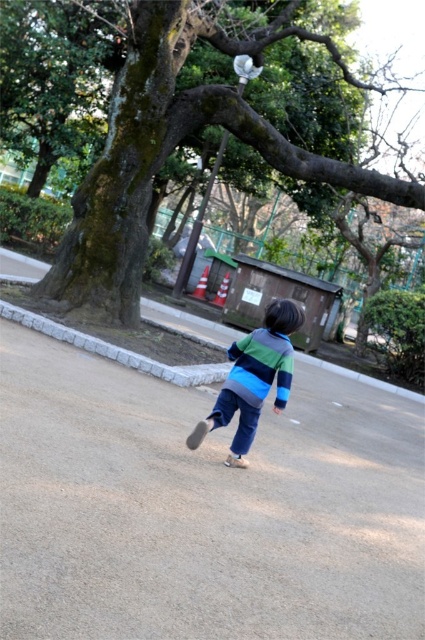
You are a photographer trying to capture a photo of the striped sweater at center while also including the green mossy tree at upper left in the frame. Based on their distance, can you estimate whether they will both fit in the camera frame?

The green mossy tree at upper left and striped sweater at center are 4.71 meters apart. Whether they fit in the frame depends on the camera lens and distance from the subjects. Without specific lens details, it is hard to say for sure, but 4.71 meters is a considerable distance, so they might not both fit unless using a wide angle.

You are a photographer trying to capture the striped sweater at center and the green mossy tree at upper left in the same frame. Based on their positions, which object should you adjust your camera to focus on first to ensure both are in the frame?

You should focus on the green mossy tree at upper left first because it is positioned to the left of the striped sweater at center, so adjusting the frame to include the leftmost object ensures the right side remains within the shot.

You are standing at a point and want to reach the child running away in the park. The path you need to take goes through point (x=391, y=179). If your walking speed is 1.2 meters per second, how long will it take you to reach the child?

The distance between the viewer and point (x=391, y=179) is 9.42 meters. At a walking speed of 1.2 meters per second, it will take approximately 7.85 seconds to reach the child.